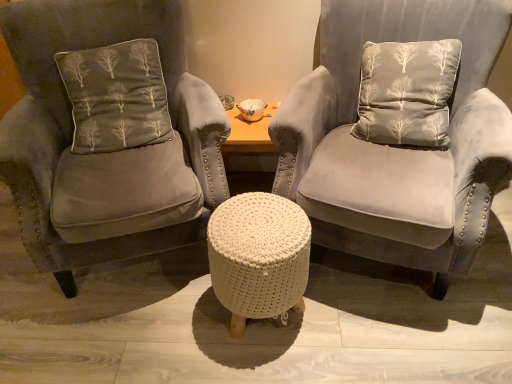
Identify the location of dark gray velvet cushion at left. (116, 96).

Where is `velvet gray chair at center, arranged as the first chair when viewed from the right`? velvet gray chair at center, arranged as the first chair when viewed from the right is located at coordinates (396, 137).

What are the coordinates of `dark gray velvet cushion at left` in the screenshot? It's located at (116, 96).

Based on the photo, considering the sizes of objects velvet gray chair at center, placed as the 2th chair when sorted from left to right, and dark gray velvet cushion at left in the image provided, who is bigger, velvet gray chair at center, placed as the 2th chair when sorted from left to right, or dark gray velvet cushion at left?

Bigger between the two is velvet gray chair at center, placed as the 2th chair when sorted from left to right.

From the image's perspective, is velvet gray chair at center, placed as the 2th chair when sorted from left to right, above or below dark gray velvet cushion at left?

Clearly, from the image's perspective, velvet gray chair at center, placed as the 2th chair when sorted from left to right, is below dark gray velvet cushion at left.

Which of these two, velvet gray chair at center, arranged as the first chair when viewed from the right, or dark gray velvet cushion at left, stands shorter?

Standing shorter between the two is dark gray velvet cushion at left.

From a real-world perspective, who is located higher, velvet gray chair at center, arranged as the first chair when viewed from the right, or dark gray velvet cushion at left?

From a 3D spatial view, dark gray velvet cushion at left is above.

Can you tell me how much white knitted pouf at center and dark gray velvet cushion at left differ in facing direction?

They differ by 22.1 degrees in their facing directions.

Is white knitted pouf at center positioned behind dark gray velvet cushion at left?

No.

The width and height of the screenshot is (512, 384). I want to click on table on the right of dark gray velvet cushion at left, so click(259, 257).

Is white knitted pouf at center looking in the opposite direction of dark gray velvet cushion at left?

No, white knitted pouf at center's orientation is not away from dark gray velvet cushion at left.

Is velvet gray armchair at center, the first chair from the left, wider or thinner than white knitted pouf at center?

Clearly, velvet gray armchair at center, the first chair from the left, has more width compared to white knitted pouf at center.

Could you tell me if velvet gray armchair at center, which ranks as the 2th chair in right-to-left order, is turned towards white knitted pouf at center?

Yes, velvet gray armchair at center, which ranks as the 2th chair in right-to-left order, faces towards white knitted pouf at center.

Is velvet gray armchair at center, which ranks as the 2th chair in right-to-left order, at the right side of white knitted pouf at center?

No, velvet gray armchair at center, which ranks as the 2th chair in right-to-left order, is not to the right of white knitted pouf at center.

Is velvet gray armchair at center, the first chair from the left, taller or shorter than white knitted pouf at center?

In the image, velvet gray armchair at center, the first chair from the left, appears to be taller than white knitted pouf at center.

Can you see velvet gray chair at center, placed as the 2th chair when sorted from left to right, touching white knitted pouf at center?

No, velvet gray chair at center, placed as the 2th chair when sorted from left to right, is not with white knitted pouf at center.

Could you measure the distance between velvet gray chair at center, placed as the 2th chair when sorted from left to right, and white knitted pouf at center?

velvet gray chair at center, placed as the 2th chair when sorted from left to right, and white knitted pouf at center are 14.20 inches apart from each other.

From the image's perspective, is velvet gray chair at center, placed as the 2th chair when sorted from left to right, located above or below white knitted pouf at center?

From the image's perspective, velvet gray chair at center, placed as the 2th chair when sorted from left to right, appears above white knitted pouf at center.

Which object is positioned more to the right, velvet gray chair at center, arranged as the first chair when viewed from the right, or white knitted pouf at center?

velvet gray chair at center, arranged as the first chair when viewed from the right, is more to the right.

Image resolution: width=512 pixels, height=384 pixels. Find the location of `chair in front of the velvet gray armchair at center, the first chair from the left`. chair in front of the velvet gray armchair at center, the first chair from the left is located at coordinates (396, 137).

Could you tell me if velvet gray armchair at center, which ranks as the 2th chair in right-to-left order, is facing velvet gray chair at center, arranged as the first chair when viewed from the right?

No, velvet gray armchair at center, which ranks as the 2th chair in right-to-left order, is not oriented towards velvet gray chair at center, arranged as the first chair when viewed from the right.

From the image's perspective, which one is positioned lower, velvet gray armchair at center, the first chair from the left, or velvet gray chair at center, placed as the 2th chair when sorted from left to right?

velvet gray chair at center, placed as the 2th chair when sorted from left to right.

What are the coordinates of `chair on the right of white knitted pouf at center` in the screenshot? It's located at (396, 137).

In the scene shown: From a real-world perspective, is white knitted pouf at center positioned over velvet gray chair at center, placed as the 2th chair when sorted from left to right, based on gravity?

No.

Is white knitted pouf at center positioned beyond the bounds of velvet gray chair at center, placed as the 2th chair when sorted from left to right?

Absolutely, white knitted pouf at center is external to velvet gray chair at center, placed as the 2th chair when sorted from left to right.

Is velvet gray chair at center, arranged as the first chair when viewed from the right, to the left of velvet gray armchair at center, which ranks as the 2th chair in right-to-left order, from the viewer's perspective?

Incorrect, velvet gray chair at center, arranged as the first chair when viewed from the right, is not on the left side of velvet gray armchair at center, which ranks as the 2th chair in right-to-left order.

From a real-world perspective, who is located lower, velvet gray chair at center, arranged as the first chair when viewed from the right, or velvet gray armchair at center, the first chair from the left?

In real-world perspective, velvet gray chair at center, arranged as the first chair when viewed from the right, is lower.

Consider the image. From the image's perspective, does velvet gray chair at center, placed as the 2th chair when sorted from left to right, appear higher than velvet gray armchair at center, which ranks as the 2th chair in right-to-left order?

No.

Which of these two, velvet gray chair at center, placed as the 2th chair when sorted from left to right, or velvet gray armchair at center, which ranks as the 2th chair in right-to-left order, stands taller?

With more height is velvet gray chair at center, placed as the 2th chair when sorted from left to right.

From a real-world perspective, which chair is the 2nd one underneath the dark gray velvet cushion at left? Please provide its 2D coordinates.

[(396, 137)]

Where is `pillow above the white knitted pouf at center (from the image's perspective)`? Image resolution: width=512 pixels, height=384 pixels. pillow above the white knitted pouf at center (from the image's perspective) is located at coordinates (116, 96).

Which object lies nearer to the anchor point white knitted pouf at center, dark gray velvet cushion at left or velvet gray armchair at center, which ranks as the 2th chair in right-to-left order?

Based on the image, velvet gray armchair at center, which ranks as the 2th chair in right-to-left order, appears to be nearer to white knitted pouf at center.

Which object lies nearer to the anchor point velvet gray chair at center, arranged as the first chair when viewed from the right, dark gray velvet cushion at left or white knitted pouf at center?

white knitted pouf at center is positioned closer to the anchor velvet gray chair at center, arranged as the first chair when viewed from the right.

Which object lies nearer to the anchor point velvet gray chair at center, placed as the 2th chair when sorted from left to right, velvet gray armchair at center, which ranks as the 2th chair in right-to-left order, or dark gray velvet cushion at left?

The object closer to velvet gray chair at center, placed as the 2th chair when sorted from left to right, is velvet gray armchair at center, which ranks as the 2th chair in right-to-left order.

When comparing their distances from dark gray velvet cushion at left, does velvet gray armchair at center, the first chair from the left, or velvet gray chair at center, arranged as the first chair when viewed from the right, seem further?

velvet gray chair at center, arranged as the first chair when viewed from the right.

Looking at the image, which one is located further to velvet gray armchair at center, the first chair from the left, white knitted pouf at center or velvet gray chair at center, placed as the 2th chair when sorted from left to right?

velvet gray chair at center, placed as the 2th chair when sorted from left to right, lies further to velvet gray armchair at center, the first chair from the left, than the other object.

When comparing their distances from white knitted pouf at center, does velvet gray armchair at center, which ranks as the 2th chair in right-to-left order, or dark gray velvet cushion at left seem closer?

The object closer to white knitted pouf at center is velvet gray armchair at center, which ranks as the 2th chair in right-to-left order.

Considering their positions, is white knitted pouf at center positioned closer to dark gray velvet cushion at left than velvet gray armchair at center, the first chair from the left?

Among the two, velvet gray armchair at center, the first chair from the left, is located nearer to dark gray velvet cushion at left.

Looking at the image, which one is located closer to velvet gray armchair at center, the first chair from the left, dark gray velvet cushion at left or velvet gray chair at center, placed as the 2th chair when sorted from left to right?

dark gray velvet cushion at left is positioned closer to the anchor velvet gray armchair at center, the first chair from the left.

Find the location of `table between dark gray velvet cushion at left and velvet gray chair at center, placed as the 2th chair when sorted from left to right, in the horizontal direction`. table between dark gray velvet cushion at left and velvet gray chair at center, placed as the 2th chair when sorted from left to right, in the horizontal direction is located at coordinates (259, 257).

Image resolution: width=512 pixels, height=384 pixels. What are the coordinates of `table situated between velvet gray armchair at center, which ranks as the 2th chair in right-to-left order, and velvet gray chair at center, placed as the 2th chair when sorted from left to right, from left to right` in the screenshot? It's located at (259, 257).

Image resolution: width=512 pixels, height=384 pixels. Find the location of `chair between dark gray velvet cushion at left and velvet gray chair at center, arranged as the first chair when viewed from the right`. chair between dark gray velvet cushion at left and velvet gray chair at center, arranged as the first chair when viewed from the right is located at coordinates (108, 133).